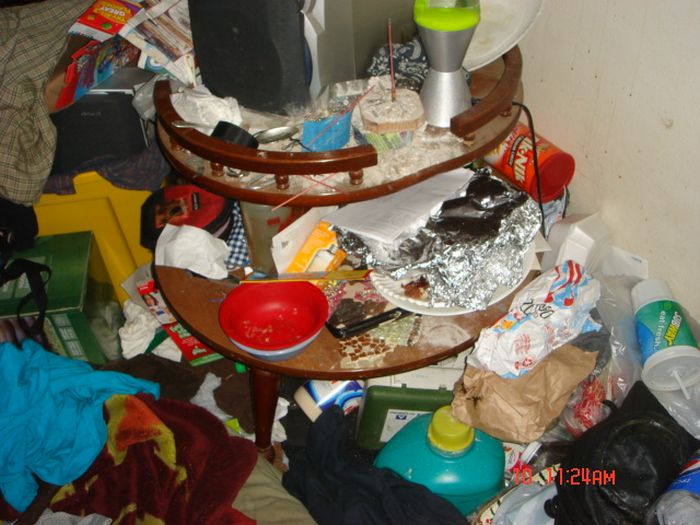
Find the location of a particular element. This screenshot has width=700, height=525. laundry is located at coordinates pyautogui.click(x=19, y=81), pyautogui.click(x=32, y=435), pyautogui.click(x=160, y=465), pyautogui.click(x=332, y=492).